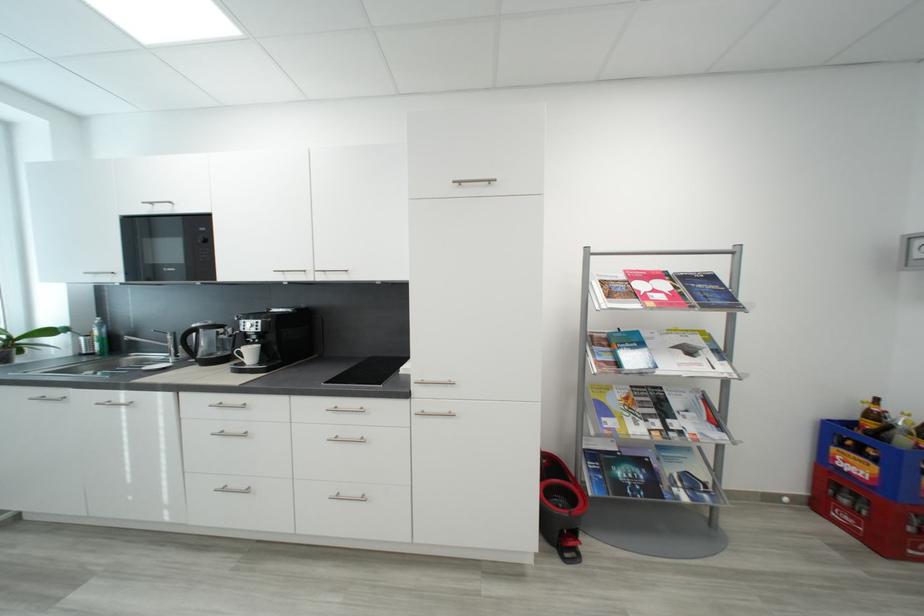
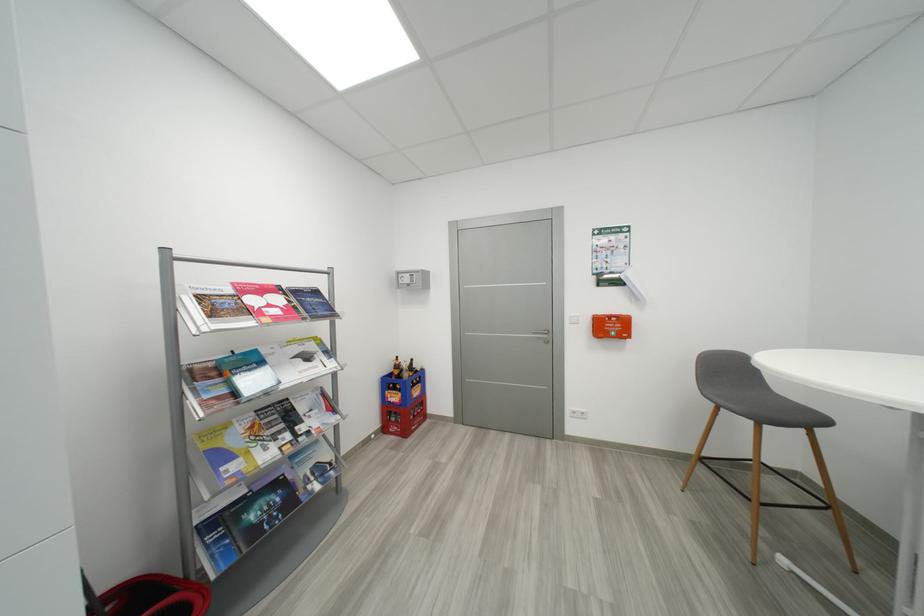
Question: The images are taken continuously from a first-person perspective. In which direction is your viewpoint rotating?

Choices:
 (A) Left
 (B) Right
 (C) Up
 (D) Down

Answer: (B)